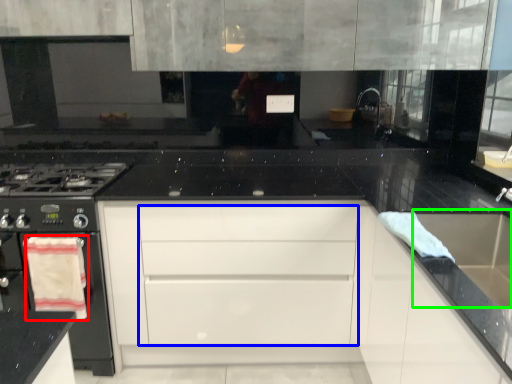
Question: Which object is the closest to the material (highlighted by a red box)? Choose among these: drawer (highlighted by a blue box) or sink (highlighted by a green box).

Choices:
 (A) drawer
 (B) sink

Answer: (A)